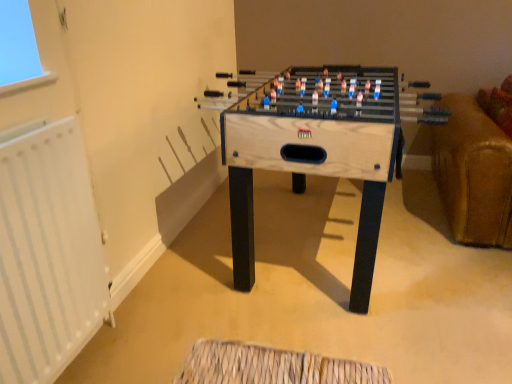
Question: From a real-world perspective, is white metallic radiator at left positioned over wooden foosball table at center based on gravity?

Choices:
 (A) yes
 (B) no

Answer: (A)

Question: Is wooden foosball table at center completely or partially inside white metallic radiator at left?

Choices:
 (A) yes
 (B) no

Answer: (B)

Question: Is white metallic radiator at left closer to the viewer compared to wooden foosball table at center?

Choices:
 (A) yes
 (B) no

Answer: (A)

Question: Is white metallic radiator at left shorter than wooden foosball table at center?

Choices:
 (A) no
 (B) yes

Answer: (A)

Question: Can you confirm if white metallic radiator at left is smaller than wooden foosball table at center?

Choices:
 (A) yes
 (B) no

Answer: (A)

Question: Considering the relative positions of white metallic radiator at left and wooden foosball table at center in the image provided, is white metallic radiator at left to the right of wooden foosball table at center from the viewer's perspective?

Choices:
 (A) no
 (B) yes

Answer: (A)

Question: Is wooden foosball table at center not close to white metallic radiator at left?

Choices:
 (A) no
 (B) yes

Answer: (A)

Question: From the image's perspective, is wooden foosball table at center over white metallic radiator at left?

Choices:
 (A) yes
 (B) no

Answer: (A)

Question: Is wooden foosball table at center surrounding white metallic radiator at left?

Choices:
 (A) yes
 (B) no

Answer: (B)

Question: Is wooden foosball table at center positioned before white metallic radiator at left?

Choices:
 (A) no
 (B) yes

Answer: (A)

Question: Considering the relative positions of wooden foosball table at center and white metallic radiator at left in the image provided, is wooden foosball table at center behind white metallic radiator at left?

Choices:
 (A) no
 (B) yes

Answer: (B)

Question: Can you confirm if wooden foosball table at center is taller than white metallic radiator at left?

Choices:
 (A) no
 (B) yes

Answer: (A)

Question: From the image's perspective, is white metallic radiator at left above or below wooden foosball table at center?

Choices:
 (A) above
 (B) below

Answer: (B)